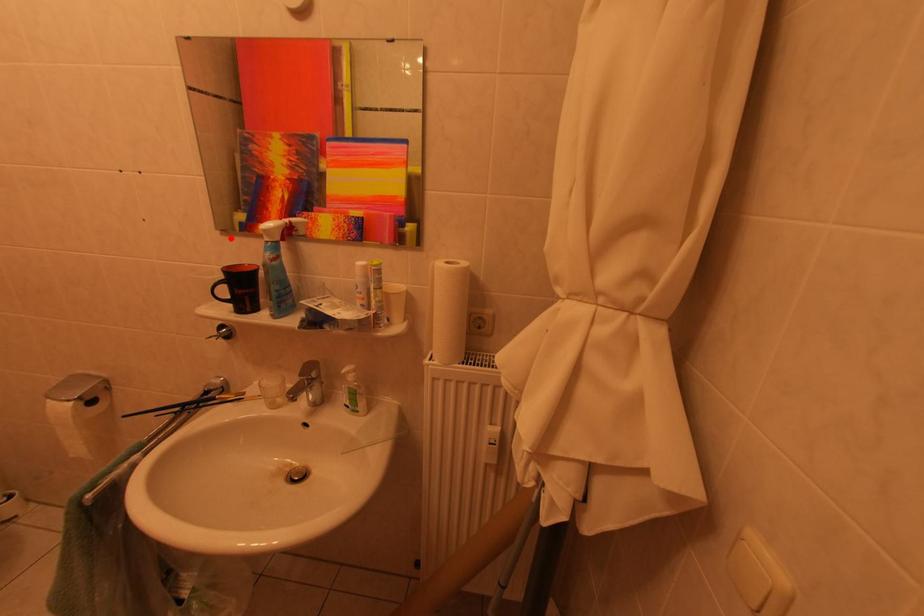
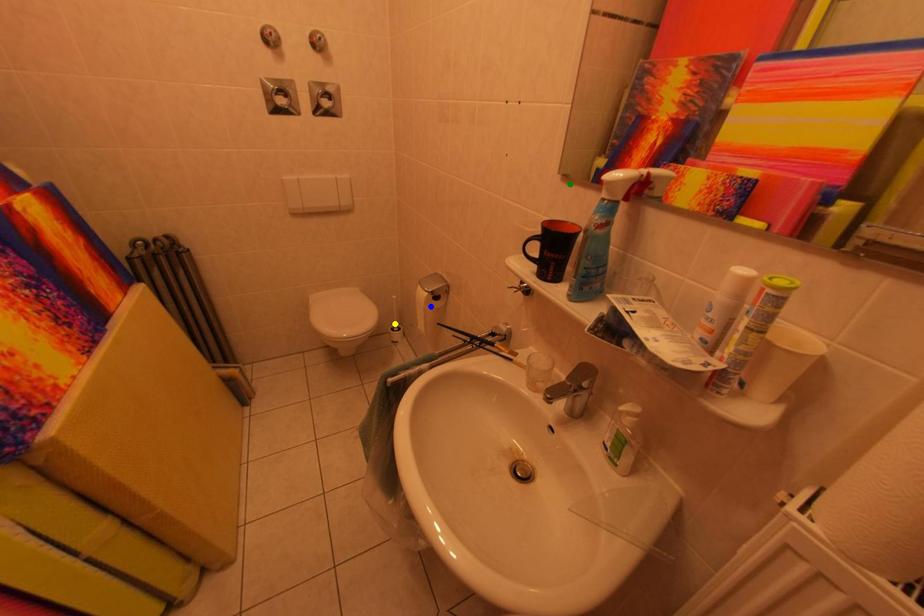
Question: I am providing you with two images of the same scene from different viewpoints. A red point is marked on the first image. You are given multiple points on the second image. Which spot in image 2 lines up with the point in image 1?

Choices:
 (A) yellow point
 (B) green point
 (C) blue point

Answer: (B)